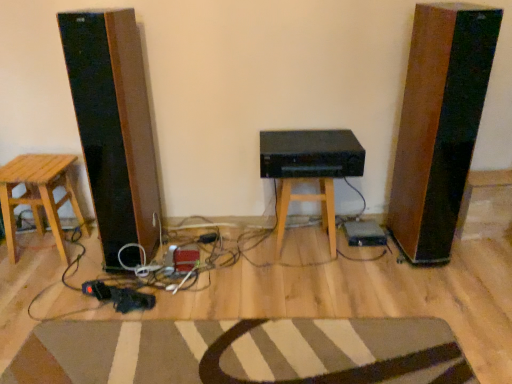
Question: In terms of width, does black matte speaker at center look wider or thinner when compared to striped wool doormat at lower center?

Choices:
 (A) wide
 (B) thin

Answer: (B)

Question: From their relative heights in the image, would you say black matte speaker at center is taller or shorter than striped wool doormat at lower center?

Choices:
 (A) short
 (B) tall

Answer: (B)

Question: Which of these objects is positioned closest to the wooden stool at center, the second stool when ordered from left to right?

Choices:
 (A) wooden stool at left, acting as the second stool starting from the right
 (B) striped wool doormat at lower center
 (C) black matte speaker at center

Answer: (C)

Question: Considering the real-world distances, which object is farthest from the wooden stool at left, arranged as the 1th stool when viewed from the left?

Choices:
 (A) wooden stool at center, the second stool when ordered from left to right
 (B) black matte speaker at center
 (C) striped wool doormat at lower center

Answer: (A)